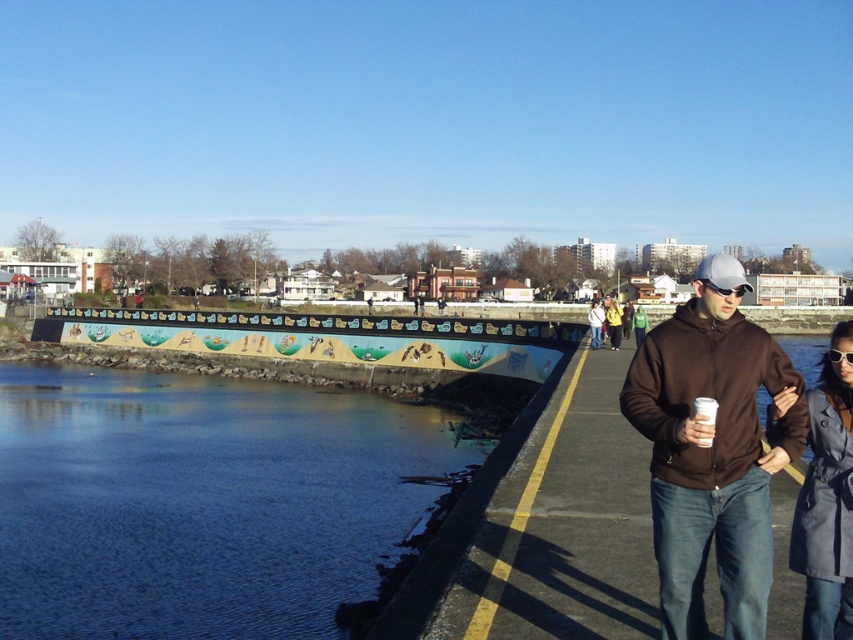
Who is more forward, (50, 525) or (732, 342)?

Point (732, 342) is in front.

Which is more to the left, blue water at lower left or brown fleece jacket at right?

Positioned to the left is blue water at lower left.

Does point (294, 458) come in front of point (682, 604)?

That is False.

You are a GUI agent. You are given a task and a screenshot of the screen. Output one action in this format:
    pyautogui.click(x=<x>, y=<y>)
    Task: Click on the blue water at lower left
    
    Given the screenshot: What is the action you would take?
    pyautogui.click(x=202, y=500)

Who is shorter, brown matte jacket at center-right or brown matte jacket at center?

With less height is brown matte jacket at center.

What do you see at coordinates (616, 320) in the screenshot?
I see `brown matte jacket at center-right` at bounding box center [616, 320].

Where is `brown matte jacket at center-right`? brown matte jacket at center-right is located at coordinates (616, 320).

Who is shorter, blue water at lower left or dark gray coat at right?

With less height is blue water at lower left.

Does point (235, 483) come behind point (815, 477)?

Yes, it is.

This screenshot has width=853, height=640. Find the location of `blue water at lower left`. blue water at lower left is located at coordinates (202, 500).